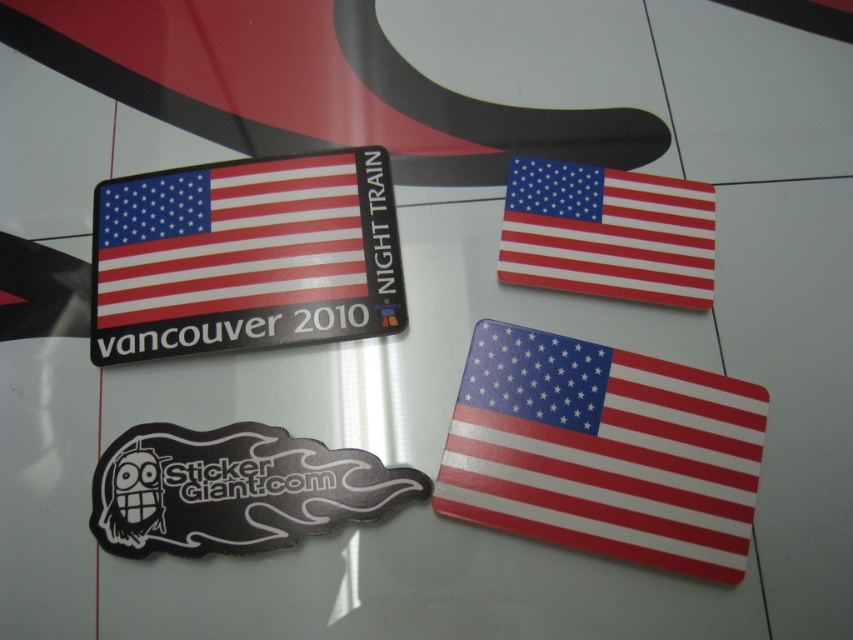
Find the location of a particular element. shiny metallic sticker at upper left is located at coordinates (247, 257).

Is point (134, 273) farther from camera compared to point (636, 195)?

That is False.

Identify the location of shiny metallic sticker at upper left. The image size is (853, 640). (247, 257).

Which is above, shiny metallic flag at center or black rubber sticker at lower left?

shiny metallic flag at center

Which of these two, shiny metallic flag at center or black rubber sticker at lower left, stands shorter?

With less height is black rubber sticker at lower left.

I want to click on shiny metallic flag at center, so click(x=604, y=451).

Is shiny metallic flag at center thinner than shiny metallic sticker at upper left?

Indeed, shiny metallic flag at center has a lesser width compared to shiny metallic sticker at upper left.

Measure the distance between point (496, 435) and camera.

Point (496, 435) and camera are 1.12 meters apart.

Where is `shiny metallic flag at center`? The height and width of the screenshot is (640, 853). shiny metallic flag at center is located at coordinates click(604, 451).

Find the location of a particular element. The width and height of the screenshot is (853, 640). shiny metallic flag at center is located at coordinates (604, 451).